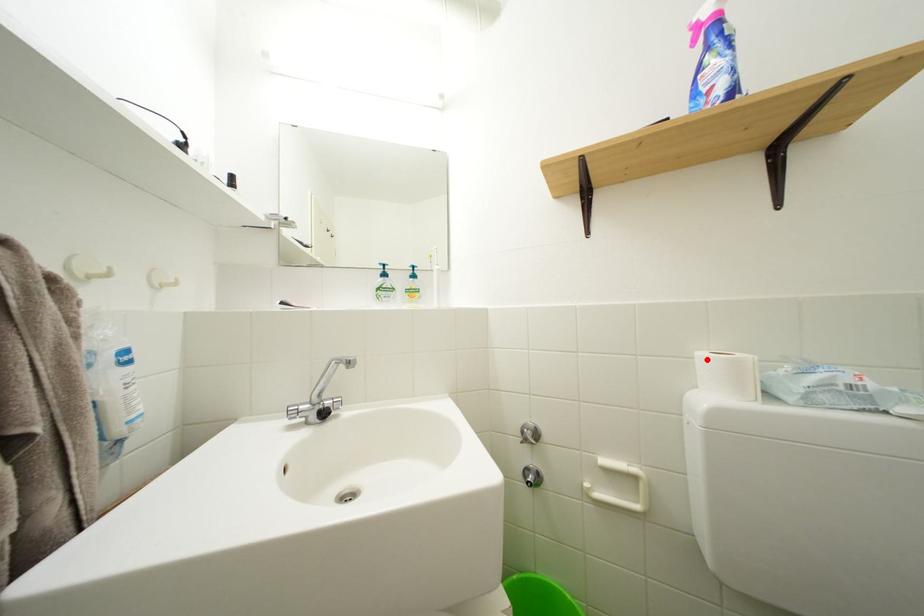
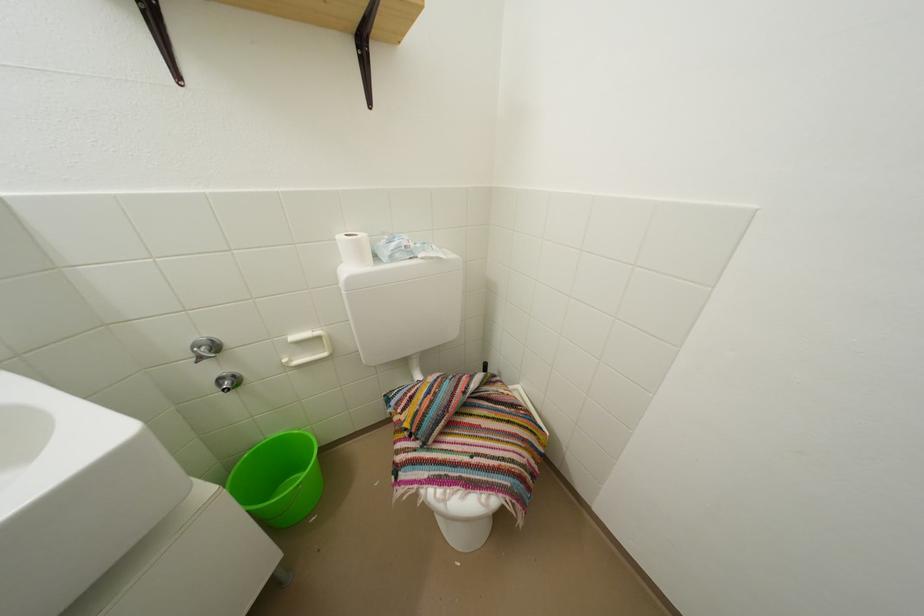
The point at the highlighted location is marked in the first image. Where is the corresponding point in the second image?

(346, 243)